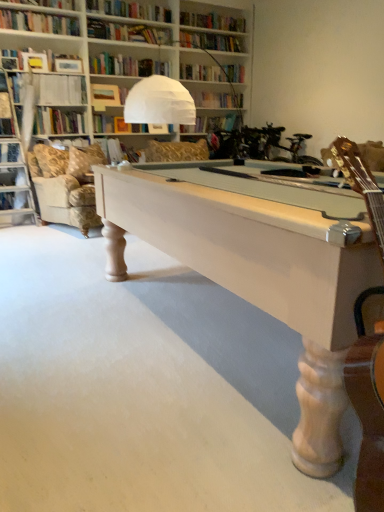
Question: Which direction should I rotate to look at matte brown book at upper center, positioned as the third book in bottom-to-top order?

Choices:
 (A) right
 (B) left

Answer: (B)

Question: Is light beige fabric couch at left positioned beyond the bounds of velvet gold swivel chair at upper left?

Choices:
 (A) yes
 (B) no

Answer: (B)

Question: Is velvet gold swivel chair at upper left inside light beige fabric couch at left?

Choices:
 (A) no
 (B) yes

Answer: (B)

Question: Is the depth of light beige fabric couch at left greater than that of velvet gold swivel chair at upper left?

Choices:
 (A) yes
 (B) no

Answer: (B)

Question: Is light beige fabric couch at left at the right side of velvet gold swivel chair at upper left?

Choices:
 (A) no
 (B) yes

Answer: (B)

Question: Is there a large distance between light beige fabric couch at left and velvet gold swivel chair at upper left?

Choices:
 (A) yes
 (B) no

Answer: (B)

Question: From the image's perspective, is light beige fabric couch at left on velvet gold swivel chair at upper left?

Choices:
 (A) yes
 (B) no

Answer: (B)

Question: Considering the relative sizes of white wood pool table at center and beige fabric pillow at left in the image provided, is white wood pool table at center wider than beige fabric pillow at left?

Choices:
 (A) yes
 (B) no

Answer: (A)

Question: From a real-world perspective, is white wood pool table at center below beige fabric pillow at left?

Choices:
 (A) no
 (B) yes

Answer: (B)

Question: Does white wood pool table at center appear on the right side of beige fabric pillow at left?

Choices:
 (A) yes
 (B) no

Answer: (A)

Question: Is white wood pool table at center surrounding beige fabric pillow at left?

Choices:
 (A) no
 (B) yes

Answer: (A)

Question: From the image's perspective, is white wood pool table at center located above beige fabric pillow at left?

Choices:
 (A) no
 (B) yes

Answer: (A)

Question: Does white wood pool table at center come in front of beige fabric pillow at left?

Choices:
 (A) no
 (B) yes

Answer: (B)

Question: Is beige fabric pillow at left positioned far away from white paper at upper left, the second book in the top-to-bottom sequence?

Choices:
 (A) yes
 (B) no

Answer: (B)